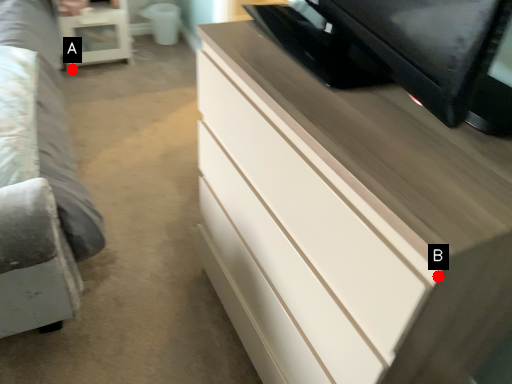
Question: Two points are circled on the image, labeled by A and B beside each circle. Which point appears farthest from the camera in this image?

Choices:
 (A) A is further
 (B) B is further

Answer: (A)